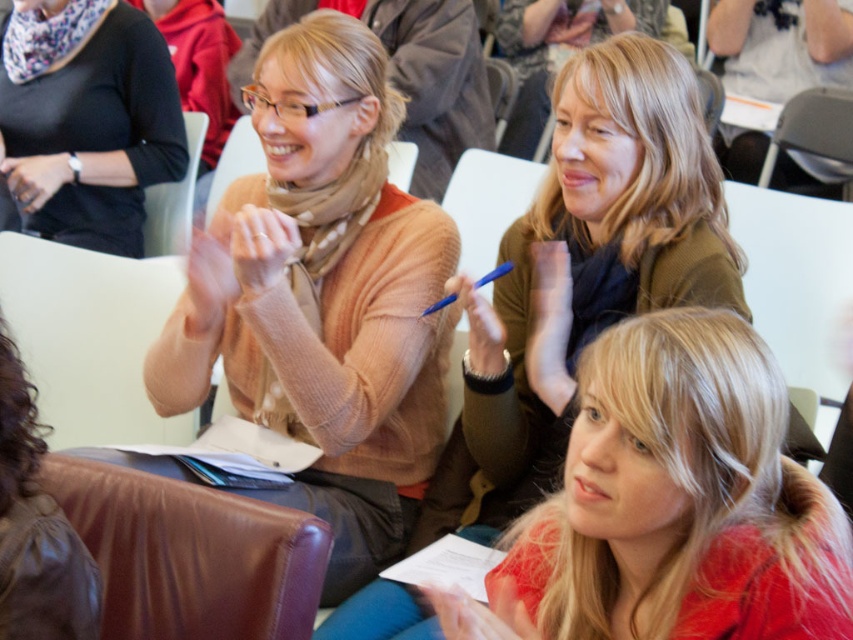
Question: Can you confirm if matte brown sweater at center is smaller than black matte scarf at upper left?

Choices:
 (A) yes
 (B) no

Answer: (B)

Question: Which of the following is the farthest from the observer?

Choices:
 (A) (691, 220)
 (B) (822, 584)

Answer: (A)

Question: Which point is closer to the camera?

Choices:
 (A) matte beige sweater at center
 (B) black matte scarf at upper left

Answer: (A)

Question: Is shiny red coat at center to the right of matte brown sweater at center from the viewer's perspective?

Choices:
 (A) yes
 (B) no

Answer: (A)

Question: Which object is positioned farthest from the matte brown sweater at center?

Choices:
 (A) shiny red coat at center
 (B) black matte scarf at upper left
 (C) matte beige sweater at center

Answer: (B)

Question: Is matte beige sweater at center to the left of black matte scarf at upper left from the viewer's perspective?

Choices:
 (A) yes
 (B) no

Answer: (B)